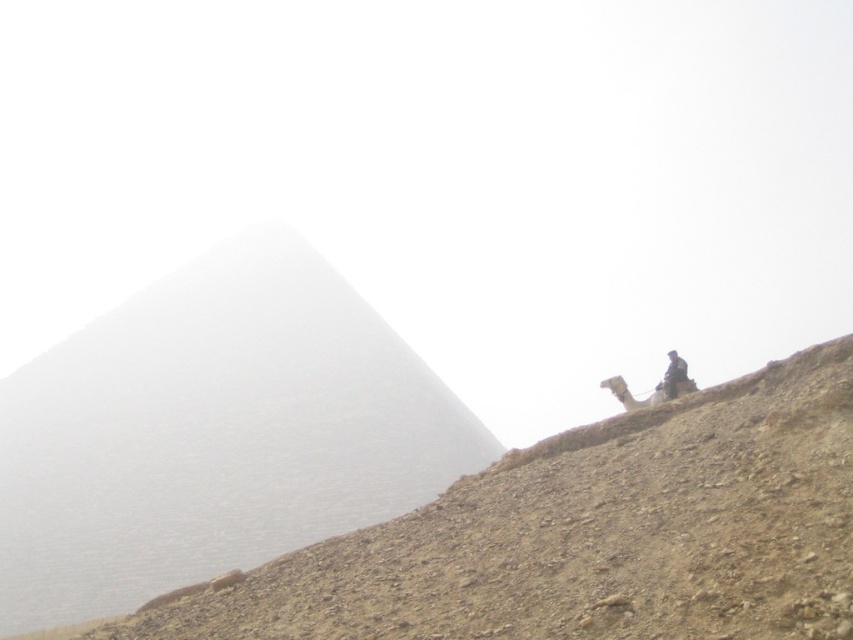
You are standing at the center of the image and want to reach the gray stone pyramid at upper left. Given that the pyramid is at coordinates 0.677 on the x and 0.251 on the y axis, can you determine the direction you should head towards?

The gray stone pyramid at upper left is located at coordinates 0.677 on the x axis and 0.251 on the y axis. Since you are at the center, you should move towards the upper left direction to reach it.

You are a traveler in this misty landscape. You see the gray stone pyramid at upper left and the dark brown leather jacket at upper right. Which object is positioned higher in the image?

The dark brown leather jacket at upper right is positioned higher than the gray stone pyramid at upper left in the image.

You are an explorer in this misty landscape. You see the gray stone pyramid at upper left and the dark brown leather jacket at upper right. Which object is larger in size?

The gray stone pyramid at upper left is bigger than the dark brown leather jacket at upper right.